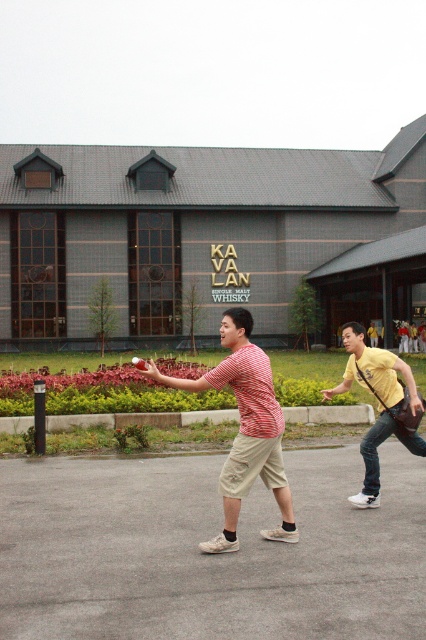
Question: Is gray brick building at center to the right of red striped shirt at center from the viewer's perspective?

Choices:
 (A) yes
 (B) no

Answer: (B)

Question: Is gray brick building at center closer to the viewer compared to yellow cotton shirt at center?

Choices:
 (A) no
 (B) yes

Answer: (A)

Question: Which point is closer to the camera?

Choices:
 (A) (348, 198)
 (B) (347, 374)

Answer: (B)

Question: Which object is closer to the camera taking this photo?

Choices:
 (A) gray brick building at center
 (B) red striped shirt at center
 (C) red plastic frisbee at center

Answer: (B)

Question: Is gray brick building at center smaller than red plastic frisbee at center?

Choices:
 (A) yes
 (B) no

Answer: (B)

Question: Among these objects, which one is nearest to the camera?

Choices:
 (A) red plastic frisbee at center
 (B) red striped shirt at center
 (C) yellow cotton shirt at center
 (D) gray brick building at center

Answer: (B)